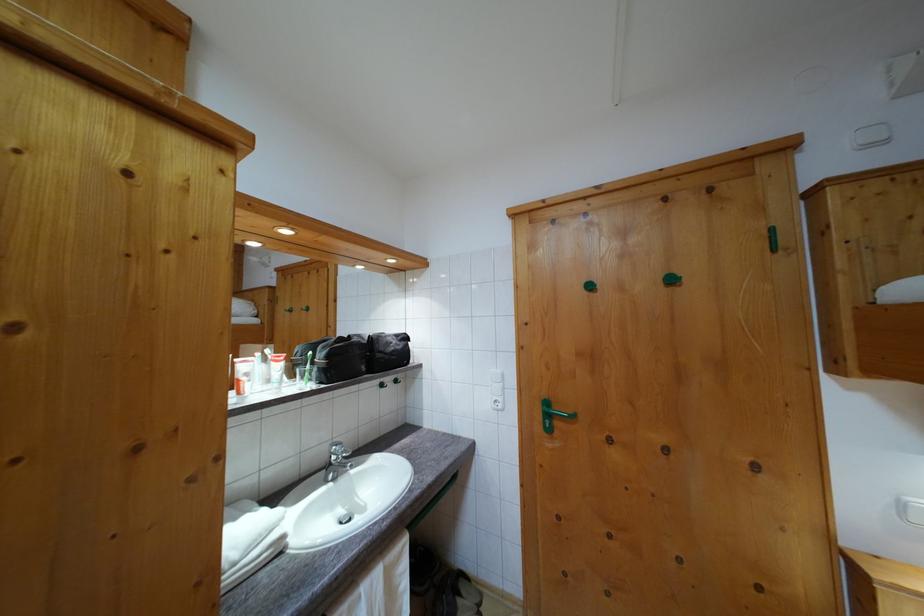
Where would you turn the faucet handle? Please return your answer as a coordinate pair (x, y).

(337, 453)